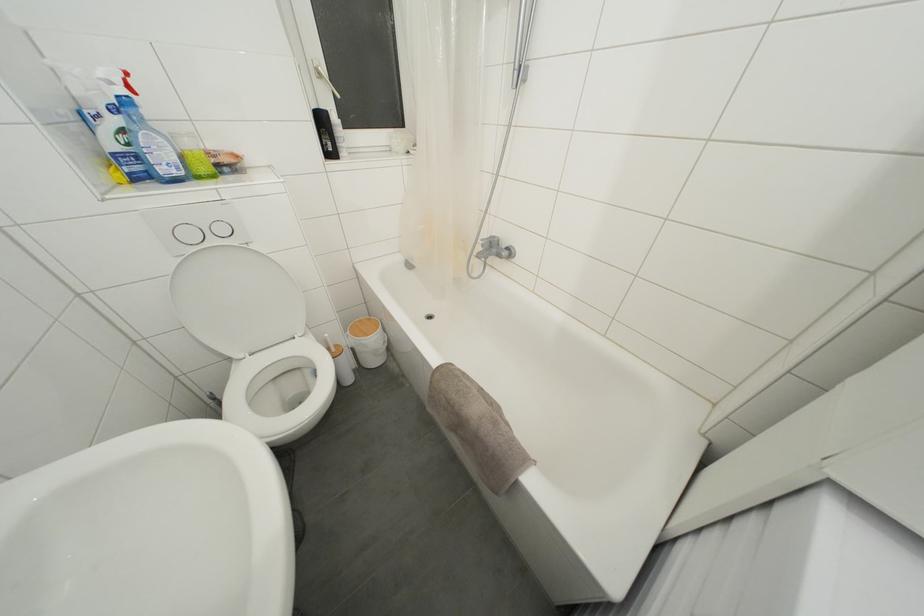
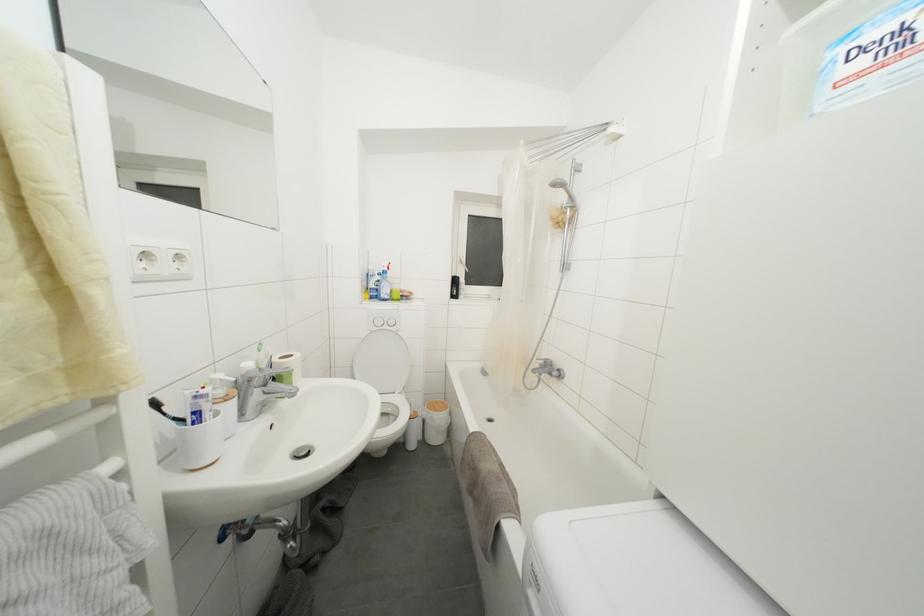
Locate, in the second image, the point that corresponds to point (445, 371) in the first image.

(480, 438)